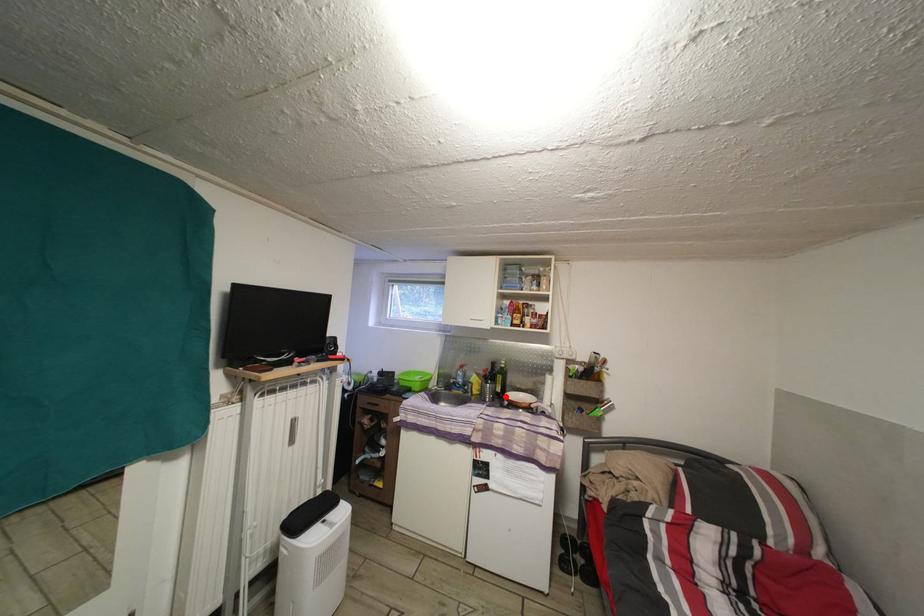
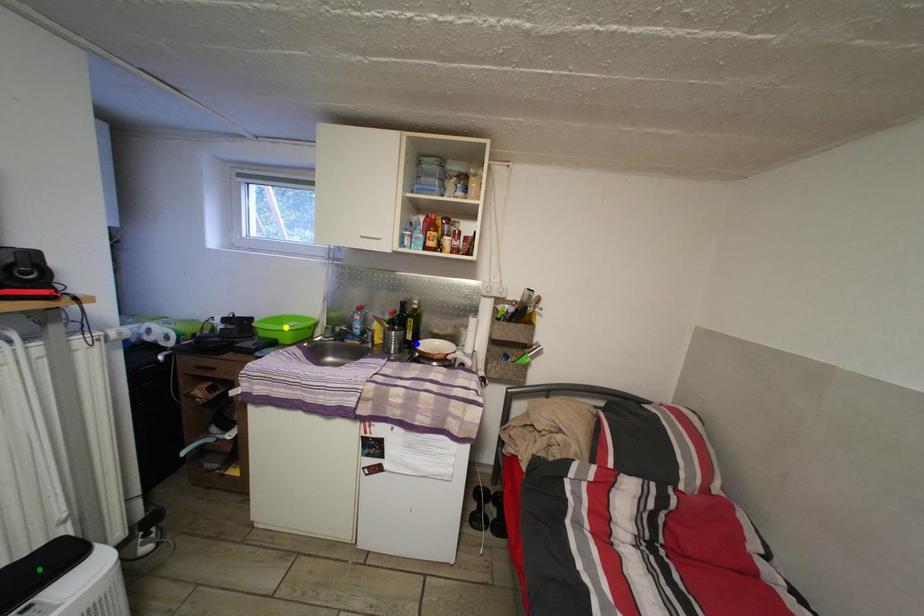
Question: I am providing you with two images of the same scene from different viewpoints. A red point is marked on the first image. You are given multiple points on the second image. Which point in image 2 is actually the same real-world point as the red point in image 1?

Choices:
 (A) yellow point
 (B) blue point
 (C) green point

Answer: (B)